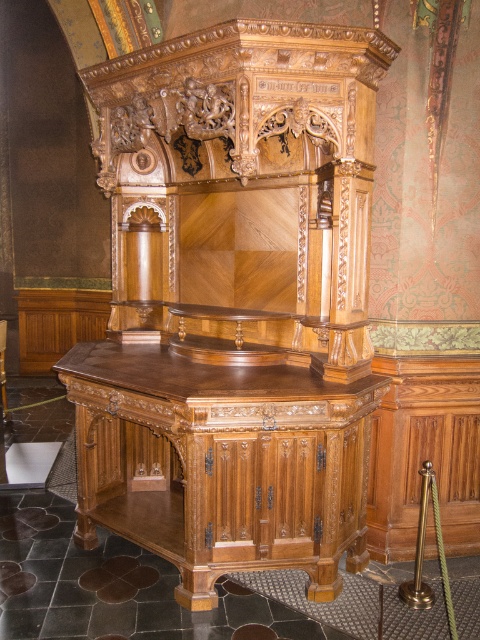
Question: Which point is closer to the camera?

Choices:
 (A) (62, 376)
 (B) (0, 324)

Answer: (A)

Question: Is polished wood table at center below wooden carved chair at center?

Choices:
 (A) yes
 (B) no

Answer: (A)

Question: Which of the following is the farthest from the observer?

Choices:
 (A) (136, 413)
 (B) (1, 348)

Answer: (B)

Question: Is polished wood table at center below wooden carved chair at center?

Choices:
 (A) no
 (B) yes

Answer: (B)

Question: Can you confirm if polished wood table at center is positioned above wooden carved chair at center?

Choices:
 (A) no
 (B) yes

Answer: (A)

Question: Which object is farther from the camera taking this photo?

Choices:
 (A) polished wood table at center
 (B) wooden carved chair at center

Answer: (B)